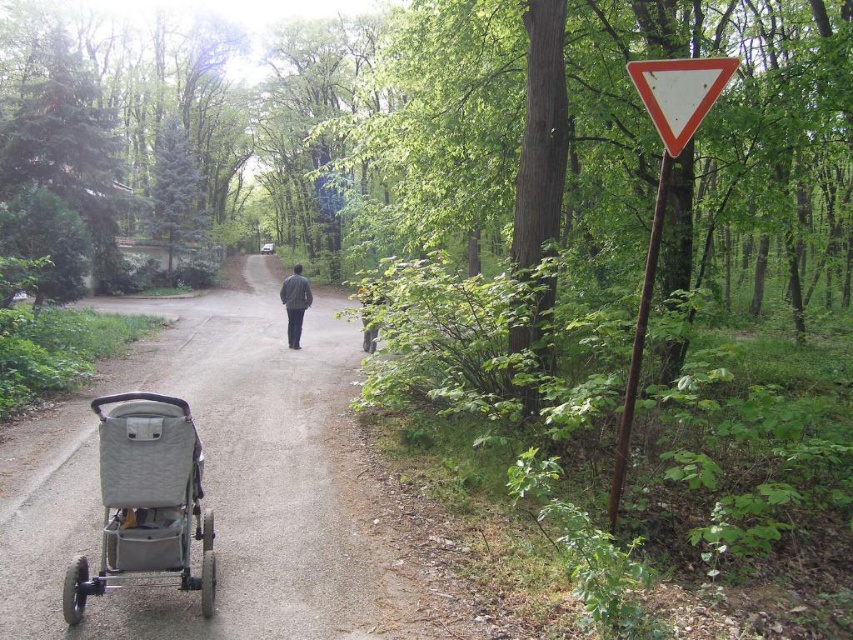
Does white plastic triangle at upper right appear on the left side of dark gray jacket at center?

Incorrect, white plastic triangle at upper right is not on the left side of dark gray jacket at center.

Does white plastic triangle at upper right have a lesser height compared to dark gray jacket at center?

Indeed, white plastic triangle at upper right has a lesser height compared to dark gray jacket at center.

Between point (686, 118) and point (287, 310), which one is positioned behind?

Point (287, 310)

You are a GUI agent. You are given a task and a screenshot of the screen. Output one action in this format:
    pyautogui.click(x=<x>, y=<y>)
    Task: Click on the white plastic triangle at upper right
    The height and width of the screenshot is (640, 853).
    Given the screenshot: What is the action you would take?
    pyautogui.click(x=679, y=93)

Does gray fabric baby carriage at lower left appear on the left side of white plastic triangle at right?

Yes, gray fabric baby carriage at lower left is to the left of white plastic triangle at right.

In the scene shown: Is gray fabric baby carriage at lower left below white plastic triangle at right?

Yes, gray fabric baby carriage at lower left is below white plastic triangle at right.

I want to click on gray fabric baby carriage at lower left, so click(146, 499).

Between gray fabric baby carriage at lower left and dark gray jacket at center, which one appears on the left side from the viewer's perspective?

dark gray jacket at center is more to the left.

Can you confirm if gray fabric baby carriage at lower left is bigger than dark gray jacket at center?

No, gray fabric baby carriage at lower left is not bigger than dark gray jacket at center.

Find the location of a particular element. Image resolution: width=853 pixels, height=640 pixels. gray fabric baby carriage at lower left is located at coordinates (146, 499).

You are a GUI agent. You are given a task and a screenshot of the screen. Output one action in this format:
    pyautogui.click(x=<x>, y=<y>)
    Task: Click on the gray fabric baby carriage at lower left
    The image size is (853, 640).
    Given the screenshot: What is the action you would take?
    pyautogui.click(x=146, y=499)